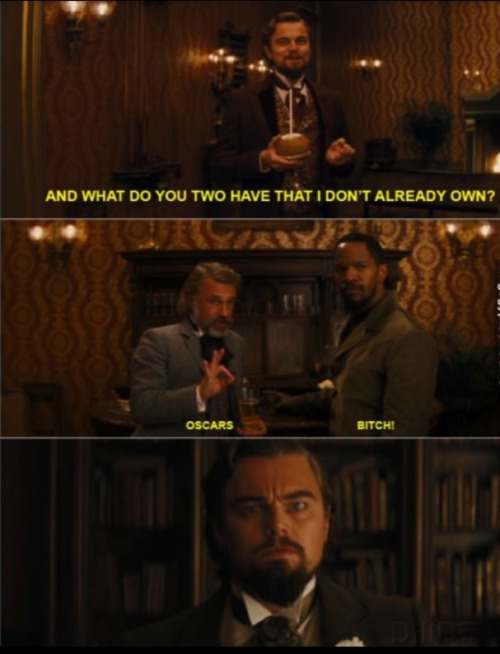
What are the coordinates of `mantel` in the screenshot? It's located at (477, 107).